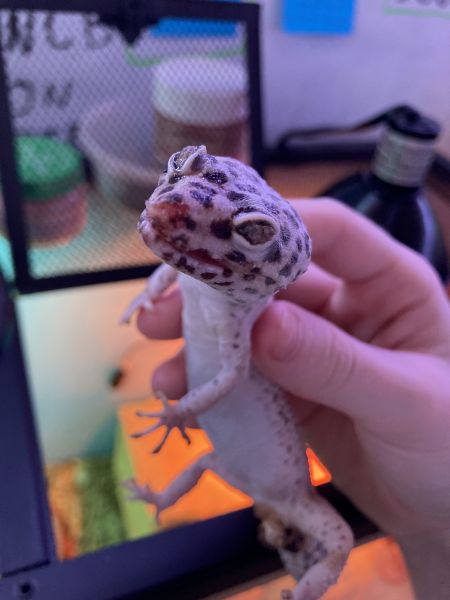
Image resolution: width=450 pixels, height=600 pixels. What are the coordinates of `bottom of hanging towel` in the screenshot? It's located at (324, 13).